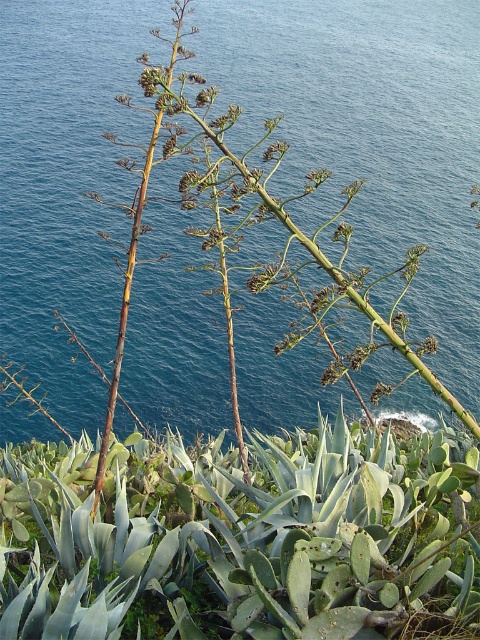
You are a hiker who wants to cross from the cliff to the ocean. The blue liquid water at center and the green succulent at center are in your path. Which one is taller and must be navigated around?

The blue liquid water at center is taller than the green succulent at center, so you must navigate around the blue liquid water at center first.

You are a botanist studying the coastal flora. You need to collect a water sample from the blue liquid water at center and a leaf sample from the green succulent at center. Given that your collection kit has a 10 meter long extendable pole, will you be able to collect both samples without moving from your current position?

The distance between the blue liquid water at center and the green succulent at center is 13.65 meters. Since your extendable pole is only 10 meters long, you cannot reach both samples from your current position without moving.

You are a photographer standing on the cliff and want to take a photo of both the succulent plants and the ocean. You notice two points on your viewfinder labeled as point 1 at coordinates point 1 at coordinates point (194,248) and point 2 at coordinates point (364,621). Which point is closer to you?

Point (194,248) is further to the camera than point (364,621), so the closer point to you is point (364,621).